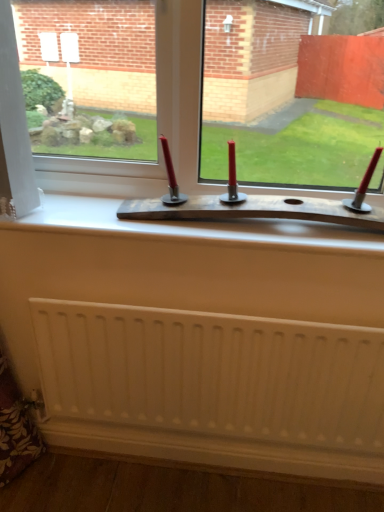
The width and height of the screenshot is (384, 512). Identify the location of free space below white matte radiator at lower center (from a real-world perspective). (205, 479).